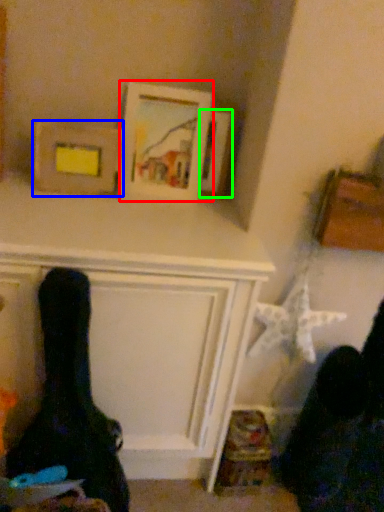
Question: Considering the real-world distances, which object is farthest from picture frame (highlighted by a red box)? picture frame (highlighted by a blue box) or picture frame (highlighted by a green box)?

Choices:
 (A) picture frame
 (B) picture frame

Answer: (A)